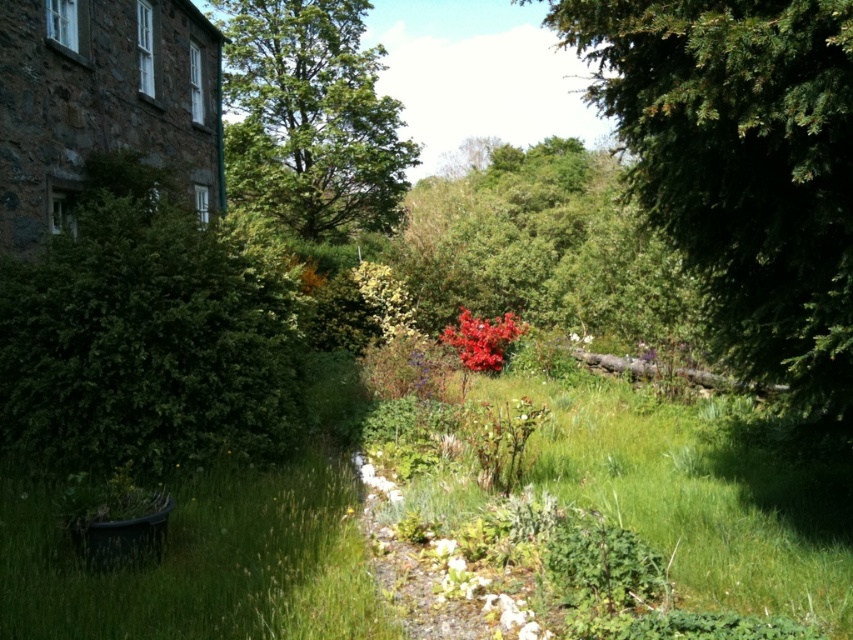
Can you confirm if green grass at center is shorter than glossy red bush at center?

Yes, green grass at center is shorter than glossy red bush at center.

Is green grass at center smaller than glossy red bush at center?

Correct, green grass at center occupies less space than glossy red bush at center.

Is point (485, 378) behind point (509, 314)?

No, (485, 378) is closer to viewer.

The width and height of the screenshot is (853, 640). I want to click on green grass at center, so click(x=697, y=499).

Between green needle-like at right and glossy red bush at center, which one has more height?

green needle-like at right

Is point (701, 42) closer to camera compared to point (497, 355)?

Yes, it is in front of point (497, 355).

Between point (802, 109) and point (486, 328), which one is positioned behind?

Point (486, 328)

At what (x,y) coordinates should I click in order to perform the action: click on green needle-like at right. Please return your answer as a coordinate pair (x, y). Looking at the image, I should click on (740, 166).

Is green needle-like at right wider than green leafy tree at upper center?

Indeed, green needle-like at right has a greater width compared to green leafy tree at upper center.

Does green needle-like at right lie in front of green leafy tree at upper center?

Yes.

Is point (735, 138) more distant than point (265, 173)?

No, (735, 138) is in front of (265, 173).

Where is `green needle-like at right`? The image size is (853, 640). green needle-like at right is located at coordinates (740, 166).